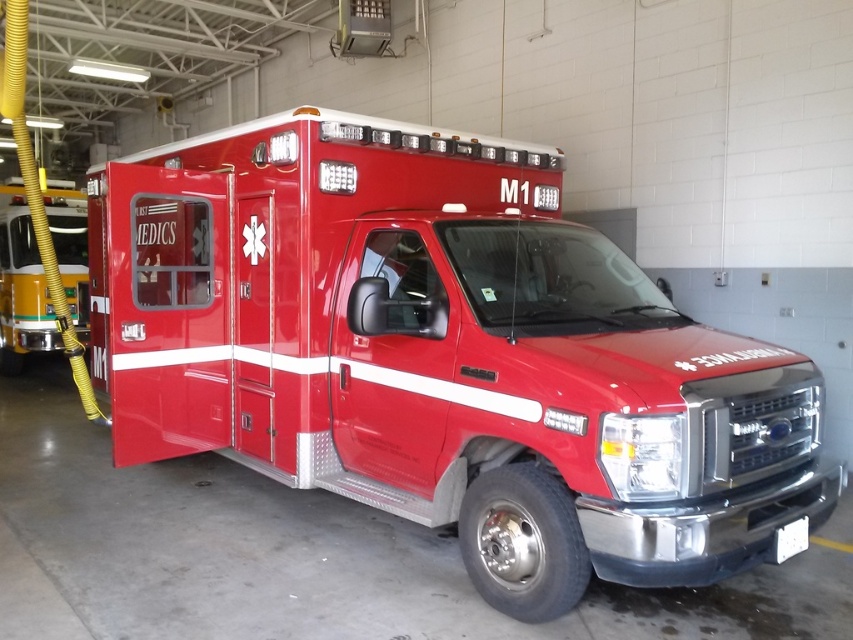
You are a GUI agent. You are given a task and a screenshot of the screen. Output one action in this format:
    pyautogui.click(x=<x>, y=<y>)
    Task: Click on the shiny red ambulance at center
    
    Given the screenshot: What is the action you would take?
    coord(444,356)

Is shiny red ambulance at center below matte yellow hose at left?

Correct, shiny red ambulance at center is located below matte yellow hose at left.

The height and width of the screenshot is (640, 853). What are the coordinates of `shiny red ambulance at center` in the screenshot? It's located at (444, 356).

Locate an element on the screen. The height and width of the screenshot is (640, 853). shiny red ambulance at center is located at coordinates (444, 356).